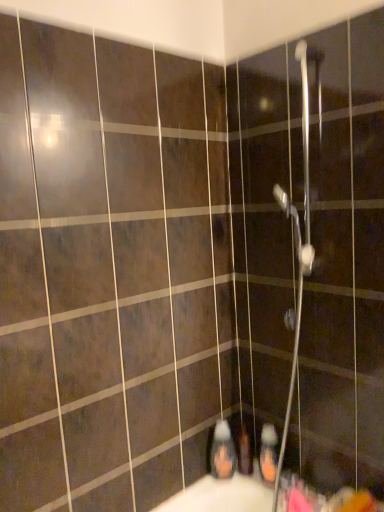
Question: Does orange matte bottle at lower center, which is the 3th toiletry in left-to-right order, have a smaller size compared to metallic silver shower head at upper center?

Choices:
 (A) no
 (B) yes

Answer: (B)

Question: Considering the relative positions of orange matte bottle at lower center, the 1th toiletry viewed from the right, and metallic silver shower head at upper center in the image provided, is orange matte bottle at lower center, the 1th toiletry viewed from the right, to the right of metallic silver shower head at upper center from the viewer's perspective?

Choices:
 (A) yes
 (B) no

Answer: (B)

Question: From a real-world perspective, is orange matte bottle at lower center, which is the 3th toiletry in left-to-right order, on top of metallic silver shower head at upper center?

Choices:
 (A) yes
 (B) no

Answer: (B)

Question: Would you consider orange matte bottle at lower center, which is the 3th toiletry in left-to-right order, to be distant from metallic silver shower head at upper center?

Choices:
 (A) no
 (B) yes

Answer: (A)

Question: Can you confirm if orange matte bottle at lower center, the 1th toiletry viewed from the right, is thinner than metallic silver shower head at upper center?

Choices:
 (A) no
 (B) yes

Answer: (B)

Question: From a real-world perspective, is matte plastic toothbrush at lower center, which is the second toiletry in right-to-left order, above or below orange matte bottle at lower center, the 1th toiletry viewed from the right?

Choices:
 (A) below
 (B) above

Answer: (A)

Question: Is matte plastic toothbrush at lower center, which is the second toiletry in right-to-left order, in front of or behind orange matte bottle at lower center, the 1th toiletry viewed from the right, in the image?

Choices:
 (A) front
 (B) behind

Answer: (B)

Question: In the image, is matte plastic toothbrush at lower center, which is the second toiletry in right-to-left order, on the left side or the right side of orange matte bottle at lower center, which is the 3th toiletry in left-to-right order?

Choices:
 (A) left
 (B) right

Answer: (A)

Question: Considering the positions of matte plastic toothbrush at lower center, which is the second toiletry in right-to-left order, and orange matte bottle at lower center, which is the 3th toiletry in left-to-right order, in the image, is matte plastic toothbrush at lower center, which is the second toiletry in right-to-left order, taller or shorter than orange matte bottle at lower center, which is the 3th toiletry in left-to-right order,?

Choices:
 (A) short
 (B) tall

Answer: (A)

Question: In terms of size, does orange matte bottle at lower center, the 1th toiletry viewed from the right, appear bigger or smaller than metallic silver shower head at upper center?

Choices:
 (A) big
 (B) small

Answer: (B)

Question: Is orange matte bottle at lower center, the 1th toiletry viewed from the right, wider or thinner than metallic silver shower head at upper center?

Choices:
 (A) thin
 (B) wide

Answer: (A)

Question: From a real-world perspective, is orange matte bottle at lower center, which is the 3th toiletry in left-to-right order, positioned above or below metallic silver shower head at upper center?

Choices:
 (A) above
 (B) below

Answer: (B)

Question: Is point (276, 453) positioned closer to the camera than point (311, 36)?

Choices:
 (A) closer
 (B) farther

Answer: (B)

Question: Do you think translucent plastic soap dispenser at lower center, placed as the third toiletry when sorted from right to left, is within matte plastic toothbrush at lower center, which is the second toiletry in right-to-left order, or outside of it?

Choices:
 (A) outside
 (B) inside

Answer: (A)

Question: Is translucent plastic soap dispenser at lower center, which is the 1th toiletry in left-to-right order, taller or shorter than matte plastic toothbrush at lower center, which is the second toiletry in right-to-left order?

Choices:
 (A) tall
 (B) short

Answer: (A)